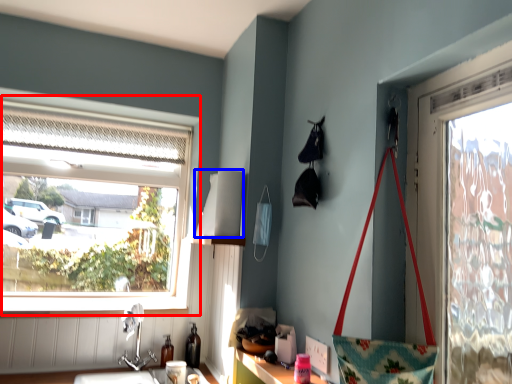
Question: Which point is further to the camera, window (highlighted by a red box) or lampshade (highlighted by a blue box)?

Choices:
 (A) window
 (B) lampshade

Answer: (A)